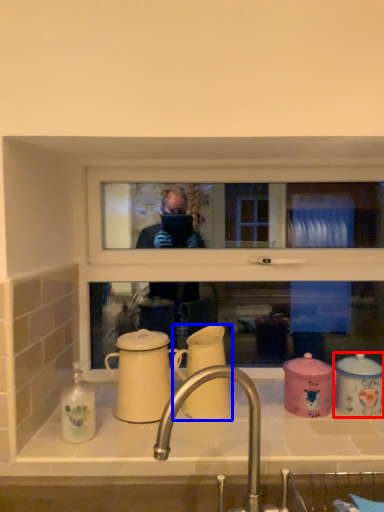
Question: Among these objects, which one is nearest to the camera, coffee cup (highlighted by a red box) or coffee cup (highlighted by a blue box)?

Choices:
 (A) coffee cup
 (B) coffee cup

Answer: (B)